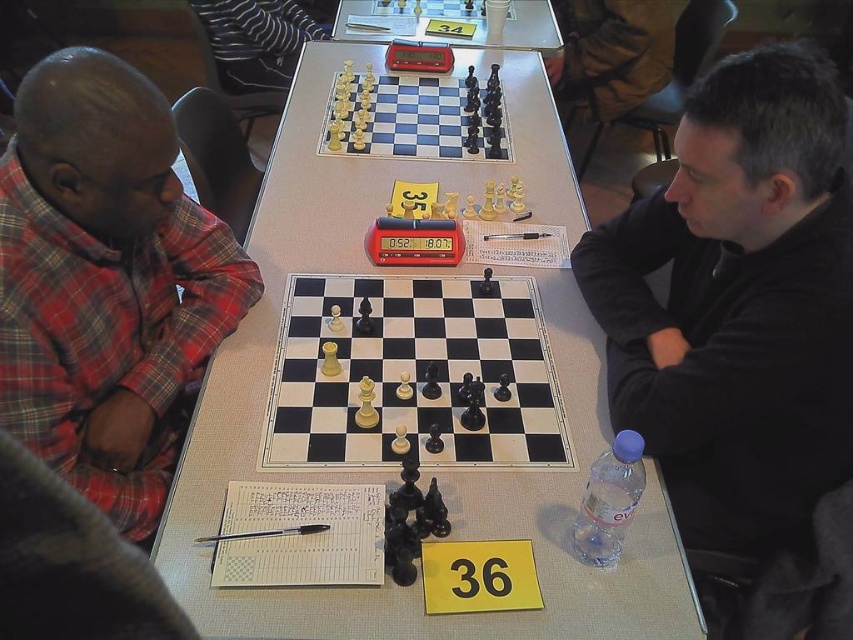
Looking at this image, can you confirm if wooden chessboard at center is shorter than wooden chess set at center?

Yes, wooden chessboard at center is shorter than wooden chess set at center.

Consider the image. Is wooden chessboard at center positioned behind wooden chess set at center?

That is False.

Is point (395, 444) positioned behind point (393, 141)?

No, (395, 444) is closer to viewer.

Where is `wooden chessboard at center`? Image resolution: width=853 pixels, height=640 pixels. wooden chessboard at center is located at coordinates (415, 374).

Which is more to the right, white glossy chessboard at center or plastic chess clock at center?

plastic chess clock at center

Who is more forward, (410, 301) or (479, 45)?

Positioned in front is point (410, 301).

The height and width of the screenshot is (640, 853). In order to click on white glossy chessboard at center in this screenshot , I will do `click(418, 394)`.

How distant is white glossy chessboard at center from black matte shirt at center?

15.23 inches

Looking at this image, is white glossy chessboard at center closer to the viewer compared to black matte shirt at center?

Yes.

Identify the location of white glossy chessboard at center. (418, 394).